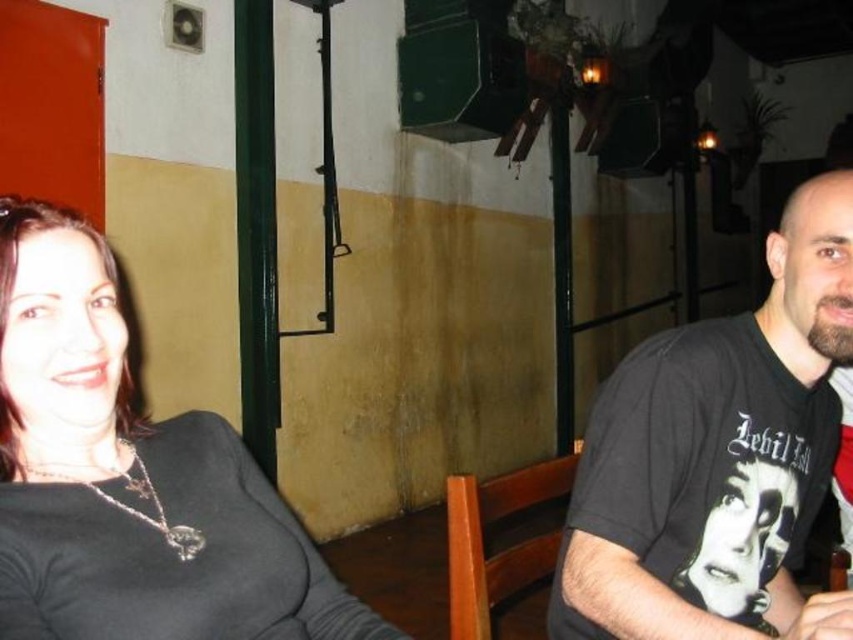
Question: Is matte black shirt at left closer to camera compared to black cotton t-shirt at right?

Choices:
 (A) yes
 (B) no

Answer: (A)

Question: Can you confirm if matte black shirt at left is thinner than black cotton t-shirt at right?

Choices:
 (A) yes
 (B) no

Answer: (A)

Question: Which point is closer to the camera?

Choices:
 (A) black cotton t-shirt at right
 (B) matte black shirt at left

Answer: (B)

Question: Does matte black shirt at left appear under black cotton t-shirt at right?

Choices:
 (A) no
 (B) yes

Answer: (A)

Question: Which point appears farthest from the camera in this image?

Choices:
 (A) (675, 368)
 (B) (78, 404)

Answer: (A)